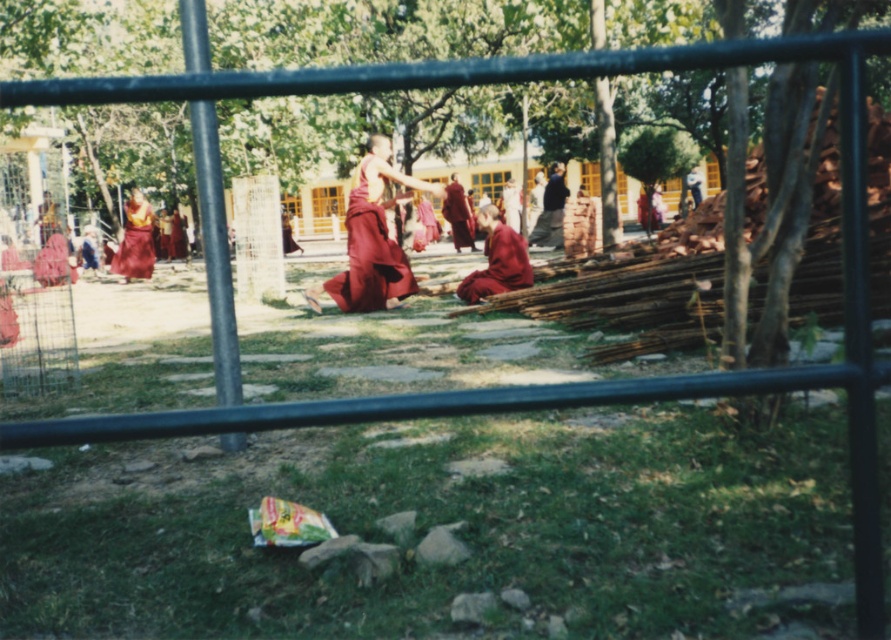
Question: Can you confirm if matte red robe at center is positioned to the right of matte red robe at left?

Choices:
 (A) yes
 (B) no

Answer: (A)

Question: Which of the following is the closest to the observer?

Choices:
 (A) matte red robe at left
 (B) maroon silk robe at center

Answer: (B)

Question: Is matte red robe at center closer to camera compared to dark gray fabric at center?

Choices:
 (A) no
 (B) yes

Answer: (B)

Question: Which point is closer to the camera?

Choices:
 (A) maroon silk robe at center
 (B) dark gray fabric at center
 (C) matte red robe at center
 (D) matte red robe at left

Answer: (A)

Question: Which point is farther to the camera?

Choices:
 (A) (125, 248)
 (B) (554, 227)

Answer: (B)

Question: From the image, what is the correct spatial relationship of maroon silk robe at center in relation to matte red robe at left?

Choices:
 (A) right
 (B) left

Answer: (A)